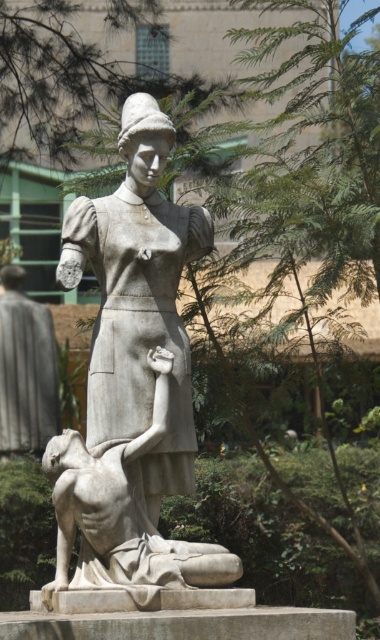
Can you confirm if matte gray statue at center is thinner than white marble statue at center?

Correct, matte gray statue at center's width is less than white marble statue at center's.

Does matte gray statue at center have a larger size compared to white marble statue at center?

Correct, matte gray statue at center is larger in size than white marble statue at center.

Is point (87, 397) farther from camera compared to point (85, 572)?

Yes, point (87, 397) is behind point (85, 572).

Find the location of `matte gray statue at center`. matte gray statue at center is located at coordinates (137, 298).